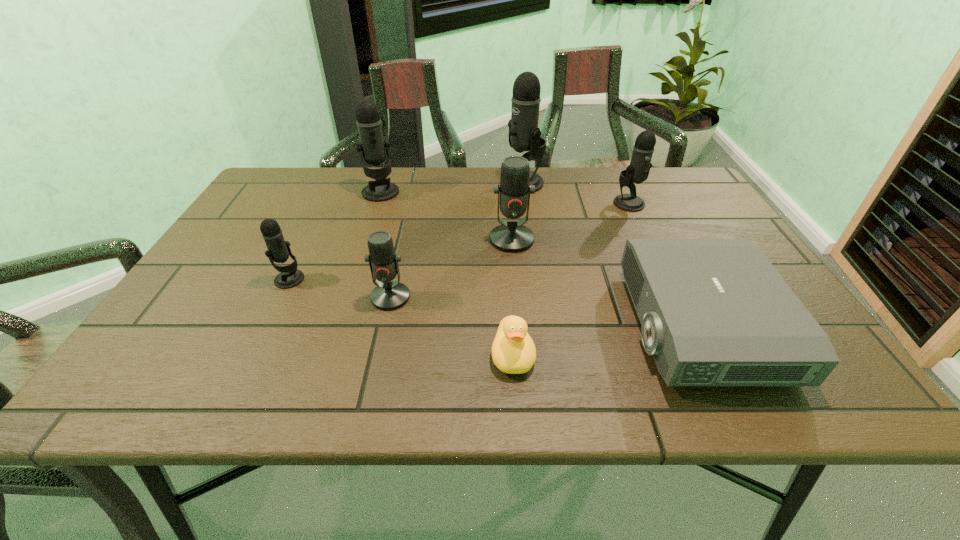
Identify the location of object that stands as the second closest to the third black microphone from right to left. (524, 135).

Where is `microphone that is the third closest to the second black microphone from left to right`? This screenshot has width=960, height=540. microphone that is the third closest to the second black microphone from left to right is located at coordinates (278, 251).

In order to click on microphone identified as the closest to the rightmost microphone in this screenshot , I will do `click(524, 135)`.

Locate which black microphone ranks third in proximity to the farther red microphone. Please provide its 2D coordinates. Your answer should be formatted as a tuple, i.e. [(x, y)], where the tuple contains the x and y coordinates of a point satisfying the conditions above.

[(373, 146)]

Locate which black microphone ranks second in proximity to the biggest black microphone. Please provide its 2D coordinates. Your answer should be formatted as a tuple, i.e. [(x, y)], where the tuple contains the x and y coordinates of a point satisfying the conditions above.

[(373, 146)]